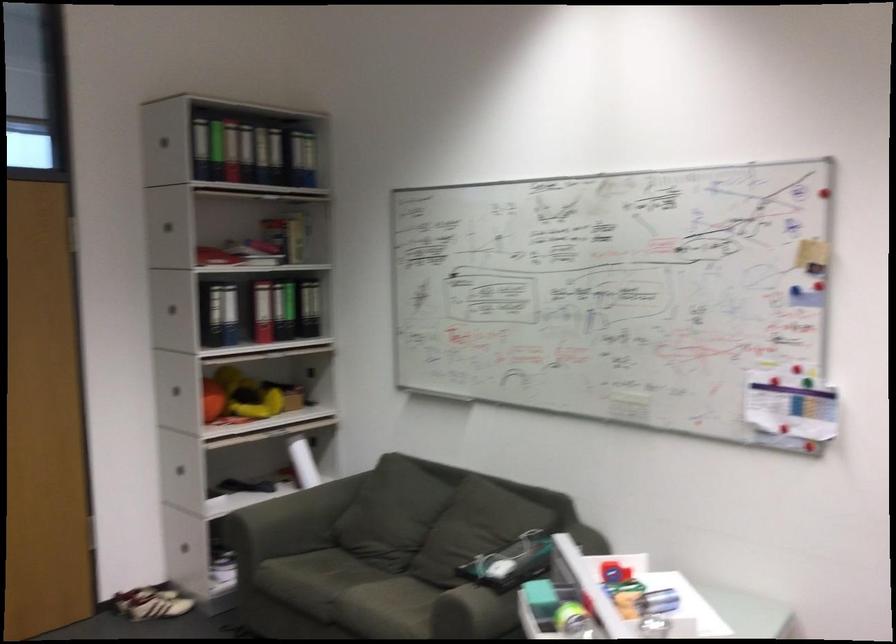
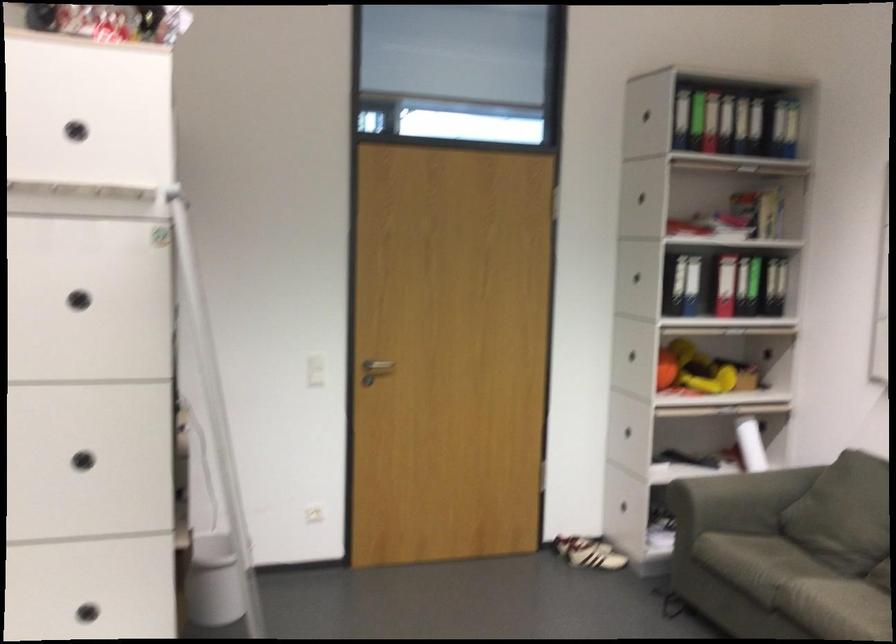
What movement of the cameraman would produce the second image?

The movement direction of the cameraman is left, forward.